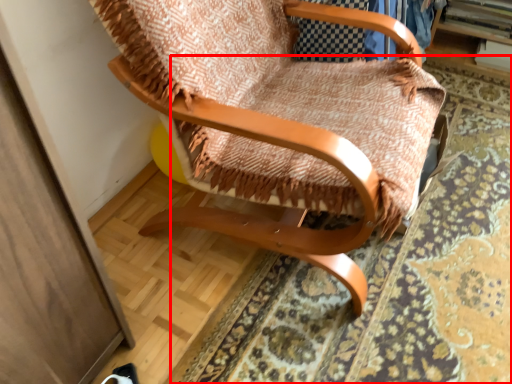
Question: From the image's perspective, where is mat (annotated by the red box) located in relation to chair in the image?

Choices:
 (A) above
 (B) below

Answer: (B)